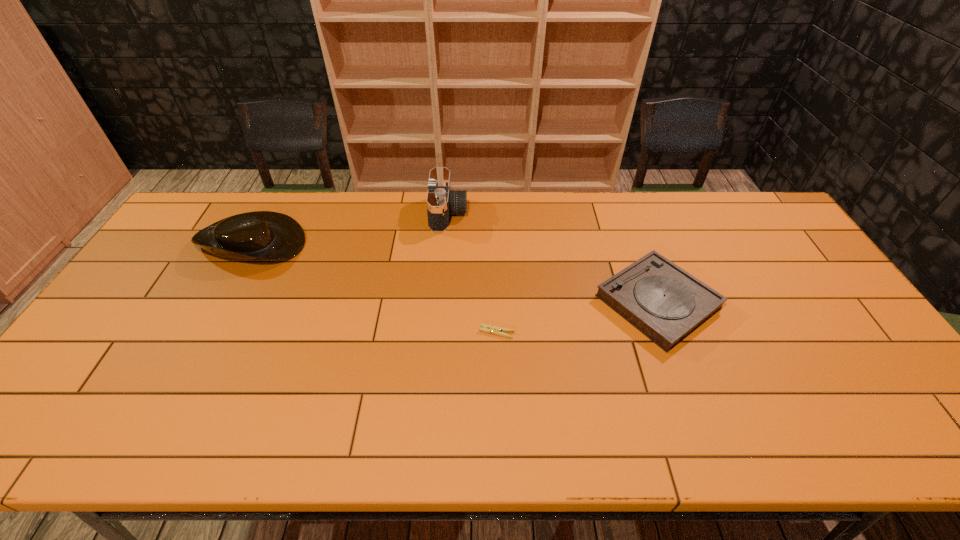
The height and width of the screenshot is (540, 960). In the image, there is a desktop. Find the location of `free space at the far right corner`. free space at the far right corner is located at coordinates (749, 204).

I want to click on blank space at the near right corner, so click(x=885, y=444).

At what (x,y) coordinates should I click in order to perform the action: click on free space between the cowboy hat and the phonograph record. Please return your answer as a coordinate pair (x, y). Looking at the image, I should click on (x=455, y=271).

Where is `vacant point located between the camera and the third object from left to right`? vacant point located between the camera and the third object from left to right is located at coordinates (472, 273).

This screenshot has width=960, height=540. Identify the location of free space between the second object from right to left and the camera. (472, 273).

Identify the location of free spot between the second object from left to right and the third tallest object. The width and height of the screenshot is (960, 540). (553, 258).

Where is `vacant space that is in between the leftmost object and the third object from right to left`? vacant space that is in between the leftmost object and the third object from right to left is located at coordinates (350, 227).

You are a GUI agent. You are given a task and a screenshot of the screen. Output one action in this format:
    pyautogui.click(x=<x>, y=<y>)
    Task: Click on the vacant space that's between the rightmost object and the cowboy hat
    
    Given the screenshot: What is the action you would take?
    pyautogui.click(x=455, y=271)

Identify the location of free space between the rightmost object and the tallest object. (553, 258).

What are the coordinates of `vacant point located between the cowboy hat and the rightmost object` in the screenshot? It's located at (455, 271).